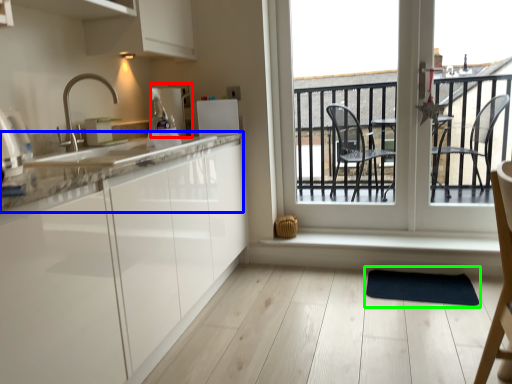
Question: Which is nearer to the appliance (highlighted by a red box)? countertop (highlighted by a blue box) or yoga mat (highlighted by a green box).

Choices:
 (A) countertop
 (B) yoga mat

Answer: (A)